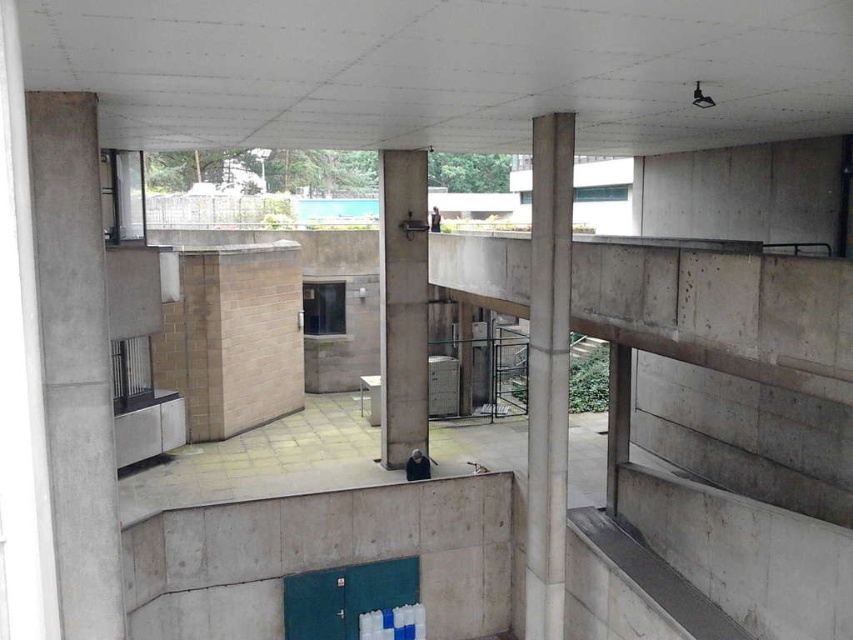
Question: Which point is closer to the camera taking this photo?

Choices:
 (A) (396, 426)
 (B) (543, 428)

Answer: (B)

Question: From the image, what is the correct spatial relationship of smooth concrete pillar at center-right in relation to concrete pillar at center?

Choices:
 (A) left
 (B) right

Answer: (B)

Question: Does smooth concrete pillar at center-right appear under concrete pillar at center?

Choices:
 (A) yes
 (B) no

Answer: (A)

Question: Which of the following is the closest to the observer?

Choices:
 (A) (51, 371)
 (B) (392, 349)

Answer: (A)

Question: Among these points, which one is nearest to the camera?

Choices:
 (A) (387, 275)
 (B) (554, 237)
 (C) (70, 634)

Answer: (C)

Question: Does concrete at left lie behind smooth concrete pillar at center-right?

Choices:
 (A) no
 (B) yes

Answer: (A)